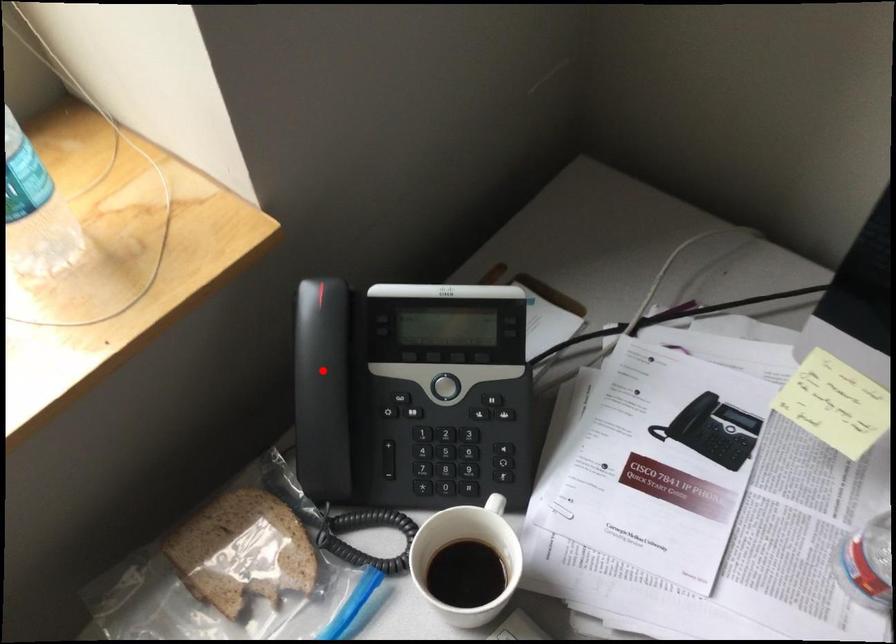
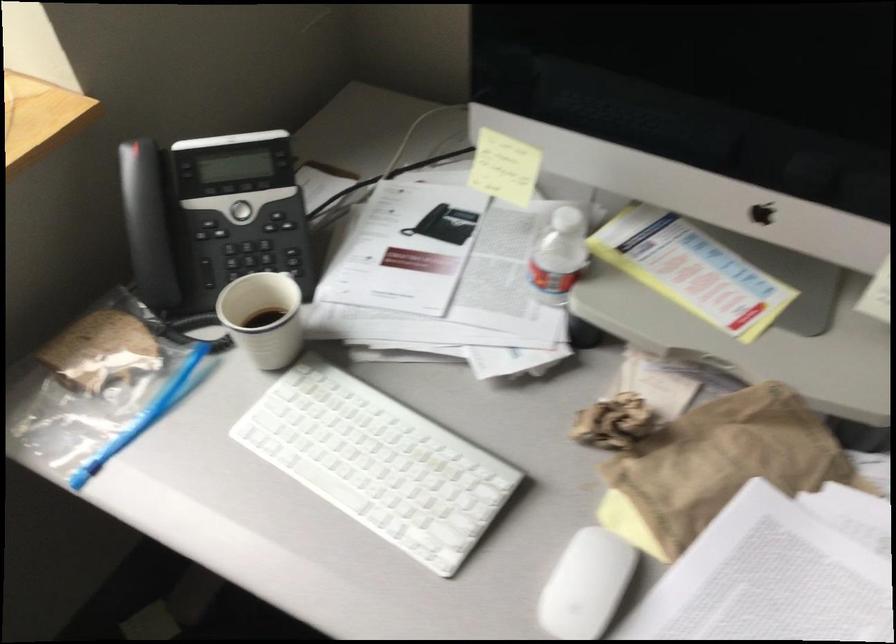
Locate, in the second image, the point that corresponds to the highlighted location in the first image.

(142, 203)